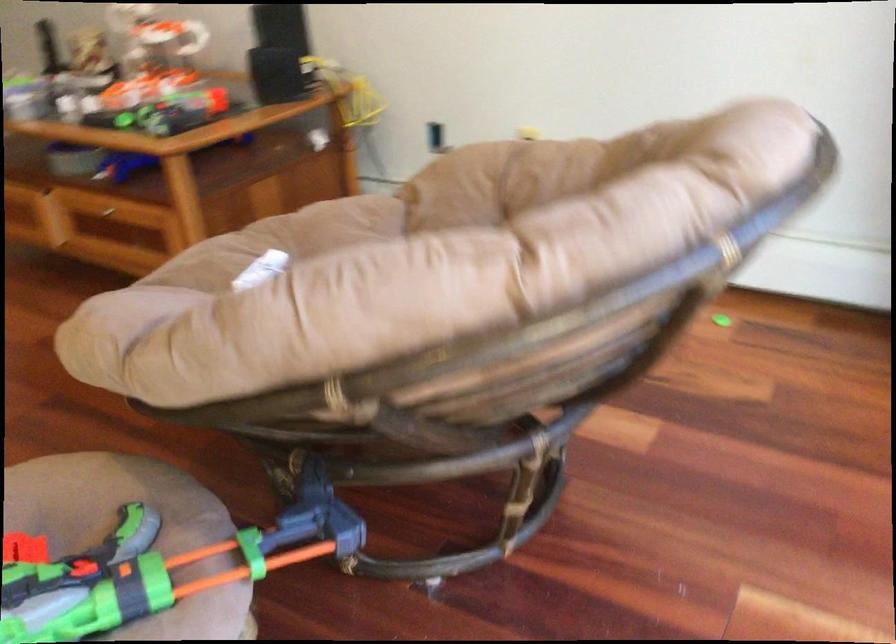
Locate an element on the screen. This screenshot has height=644, width=896. chair sitting surface is located at coordinates (281, 241).